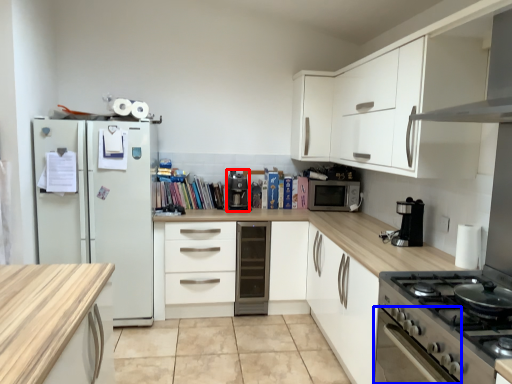
Question: Which point is closer to the camera, coffee machine (highlighted by a red box) or oven (highlighted by a blue box)?

Choices:
 (A) coffee machine
 (B) oven

Answer: (B)